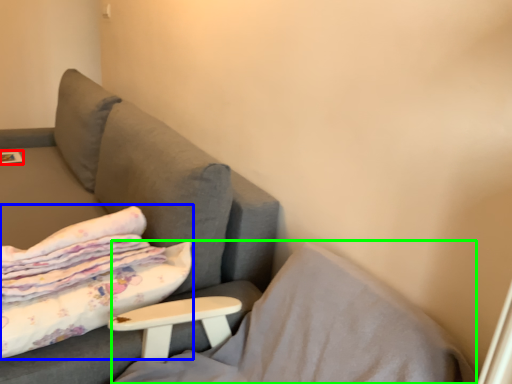
Question: Estimate the real-world distances between objects in this image. Which object is closer to magazine (highlighted by a red box), bed (highlighted by a blue box) or pillow (highlighted by a green box)?

Choices:
 (A) bed
 (B) pillow

Answer: (A)